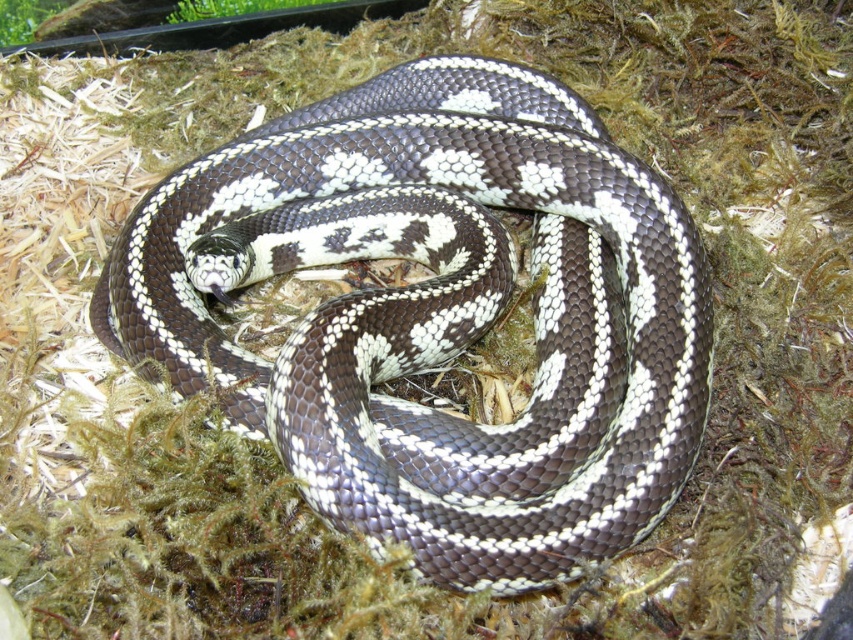
You are a wildlife photographer observing the scene. You notice the shiny brown snake at center and the green mossy grass at upper left. Which object is positioned higher in the image?

The green mossy grass at upper left is positioned higher in the image than the shiny brown snake at center.

You are observing the coiled snake and notice two points marked on its body. The first point is at coordinates point (675,333) and the second at point (289,4). Which of these points is closer to your perspective as the viewer?

Point (675,333) is closer to the viewer than point (289,4).

You are a biologist observing a snake habitat. You notice two patches of green mossy grass at upper center and green mossy grass at upper left. Which one is larger in size?

The green mossy grass at upper center is bigger than the green mossy grass at upper left.